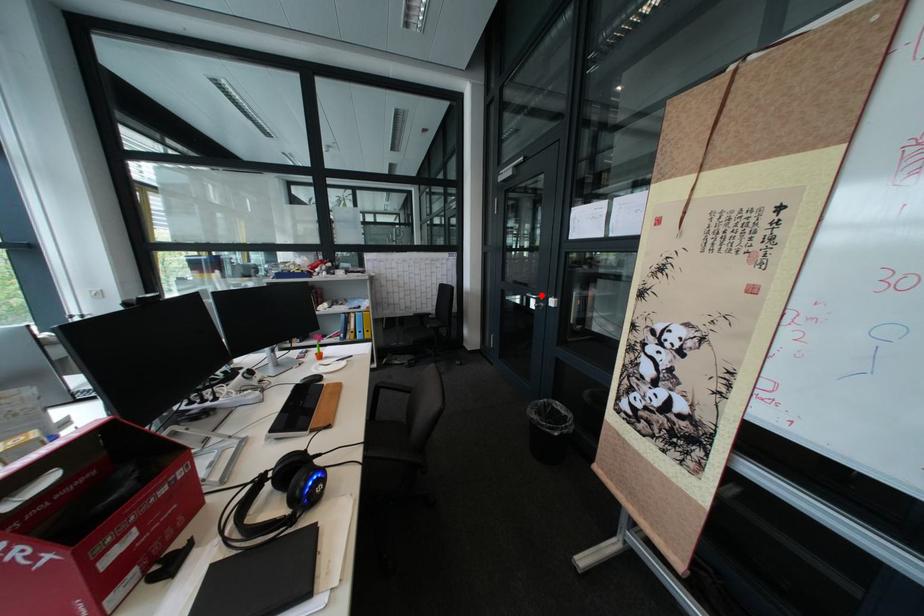
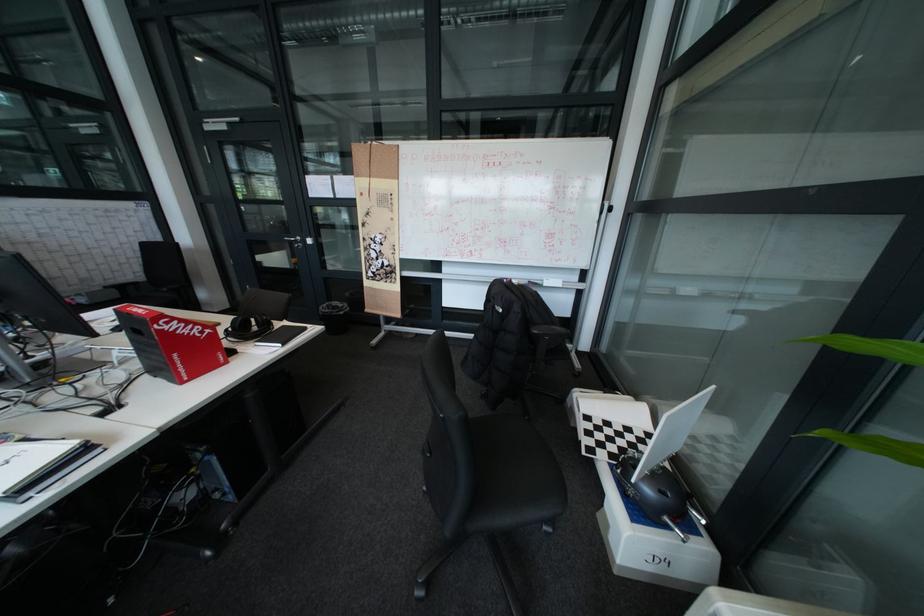
The point at the highlighted location is marked in the first image. Where is the corresponding point in the second image?

(299, 238)